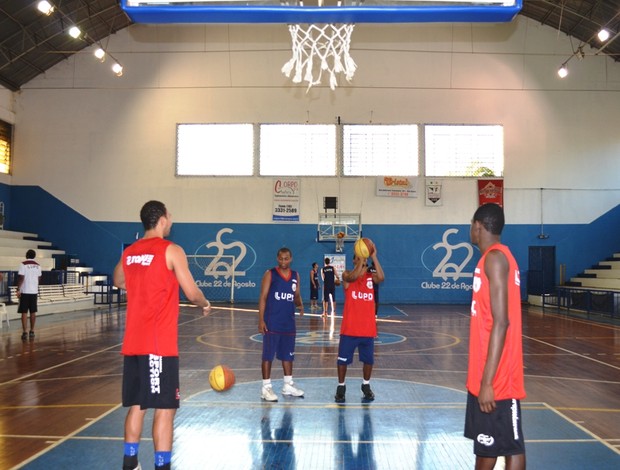
What are the coordinates of `windows` in the screenshot? It's located at (221, 161), (311, 157), (381, 142), (446, 142).